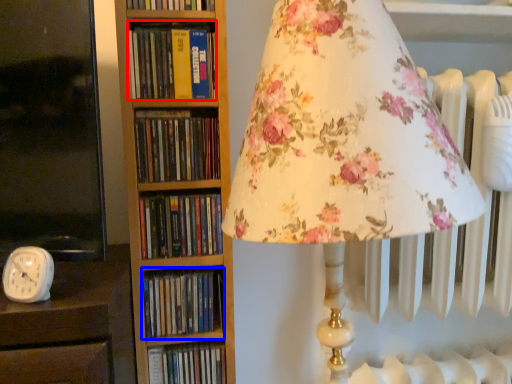
Question: Among these objects, which one is nearest to the camera, book (highlighted by a red box) or book (highlighted by a blue box)?

Choices:
 (A) book
 (B) book

Answer: (A)